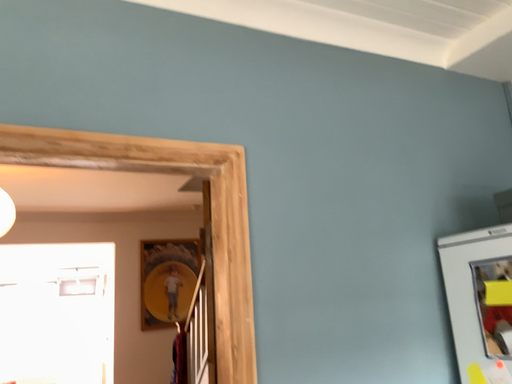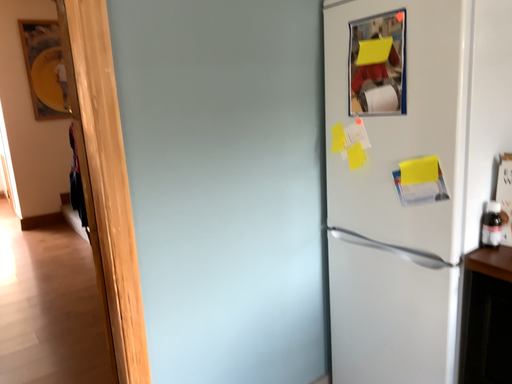
Question: Which way did the camera rotate in the video?

Choices:
 (A) rotated right
 (B) rotated left

Answer: (A)